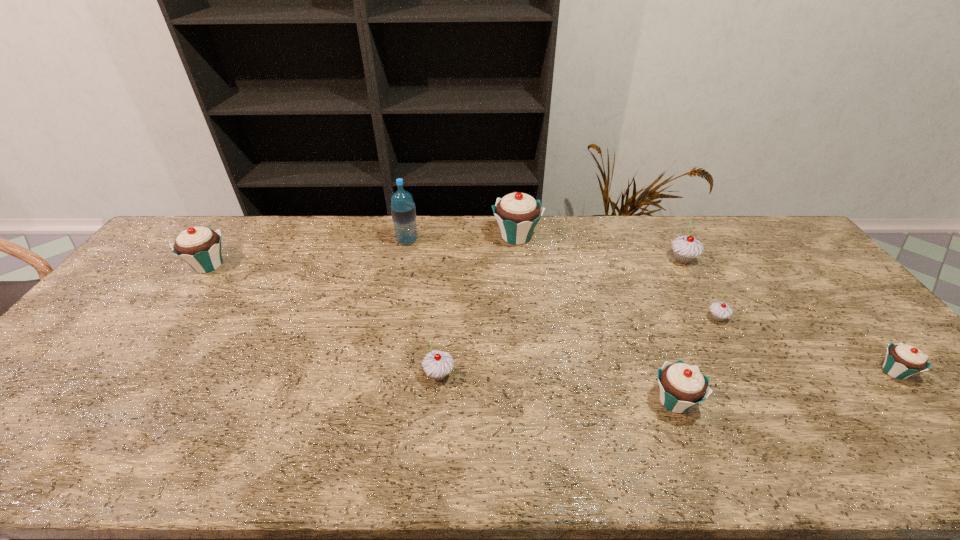
Locate an element on the screen. The width and height of the screenshot is (960, 540). the third biggest teal cupcake is located at coordinates (682, 386).

Where is `the fourth farthest cupcake`? the fourth farthest cupcake is located at coordinates (719, 311).

At what (x,y) coordinates should I click in order to perform the action: click on the second farthest gray cupcake. Please return your answer as a coordinate pair (x, y). The image size is (960, 540). Looking at the image, I should click on (719, 311).

Image resolution: width=960 pixels, height=540 pixels. I want to click on the smallest teal cupcake, so click(902, 361).

You are a GUI agent. You are given a task and a screenshot of the screen. Output one action in this format:
    pyautogui.click(x=<x>, y=<y>)
    Task: Click on the rightmost teal cupcake
    
    Given the screenshot: What is the action you would take?
    pyautogui.click(x=902, y=361)

The height and width of the screenshot is (540, 960). I want to click on free space located on the right of the water bottle, so [463, 241].

This screenshot has height=540, width=960. I want to click on vacant position located 0.150m on the right of the tallest cupcake, so 585,237.

I want to click on vacant position located on the front of the farthest gray cupcake, so click(707, 304).

What are the coordinates of `free space located 0.070m on the front of the leftmost cupcake` in the screenshot? It's located at (186, 296).

At what (x,y) coordinates should I click in order to perform the action: click on vacant space situated 0.300m on the right of the third object from left to right. Please return your answer as a coordinate pair (x, y). The height and width of the screenshot is (540, 960). Looking at the image, I should click on (575, 374).